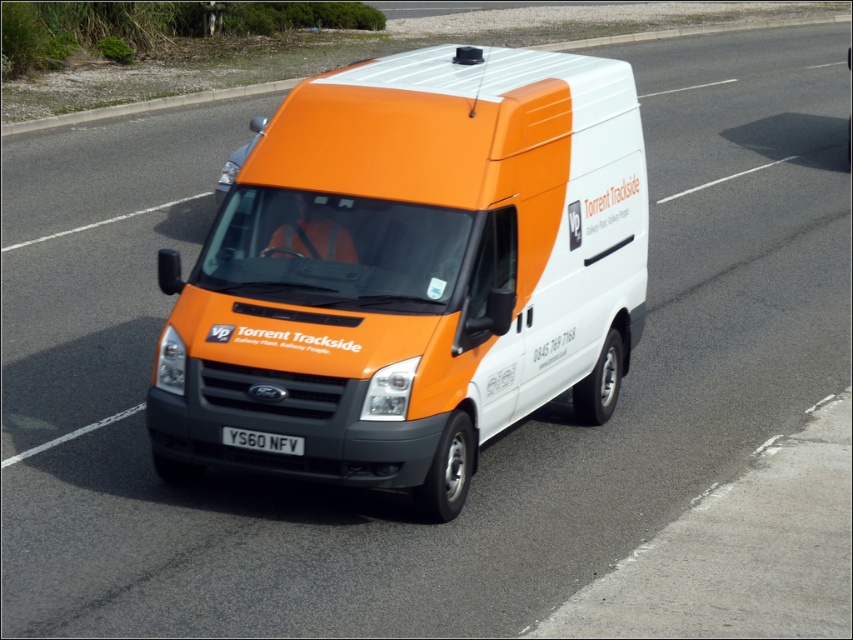
Consider the image. You are a traffic officer observing a Ford Transit van on the road. You notice the orange matte van at center and the black metal license plate at center. Based on their positions, can you determine which object is higher in the image?

The orange matte van at center is above the black metal license plate at center, so the orange matte van at center is higher in the image.

You are a traffic officer observing a vehicle on the road. You notice an orange matte van at center and a black metal license plate at center. Which object is bigger in size?

The orange matte van at center has a larger size compared to the black metal license plate at center.